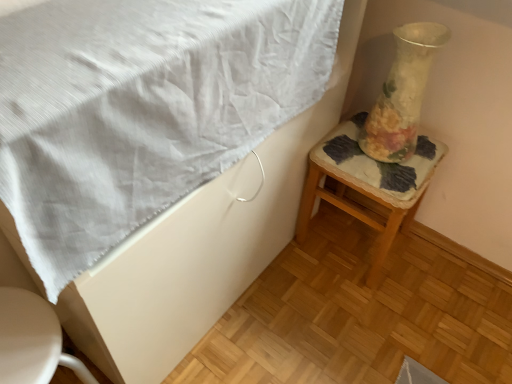
Where is `vacant region above wooden stool with floral cushion at right (from a real-world perspective)`? This screenshot has width=512, height=384. vacant region above wooden stool with floral cushion at right (from a real-world perspective) is located at coordinates (384, 159).